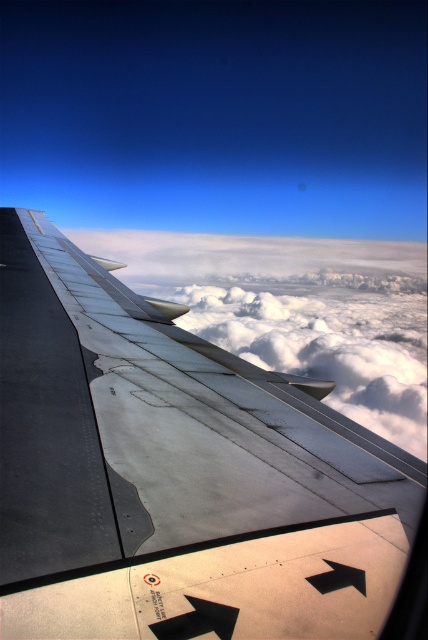
You are a passenger sitting in the airplane and looking out the window. You see the metallic gray wing at upper left and the white fluffy cloud at upper center. Which object is higher in the sky?

The metallic gray wing at upper left is higher in the sky than the white fluffy cloud at upper center because it is positioned above it.

You are sitting in a window seat on the airplane and want to know which of the two points, point (196,593) or point (133,253), is nearer to you. Can you determine this based on the view outside?

Point (196,593) is closer to the viewer than point (133,253), so the point (196,593) is nearer to you.

Looking at this image, you are sitting in an airplane seat and want to look out the window to see the wing. If you extend your arm straight out towards the window, your fingertip will be at point (306, 428). Can your fingertip reach the wing through the window?

The distance of point (306, 428) from camera is 6.43 feet. Since the wing is outside the airplane, your fingertip cannot reach it through the window as it is much farther away than 6.43 feet.